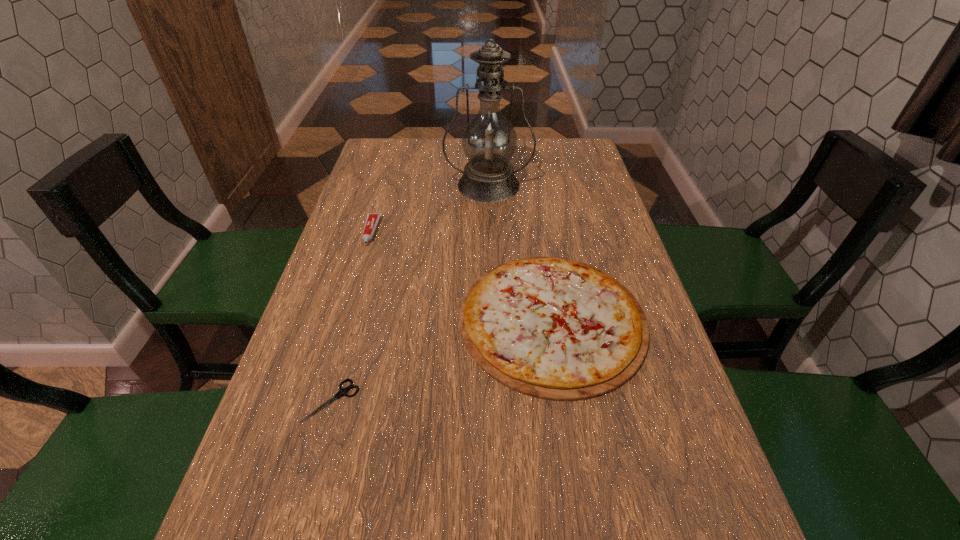
Where is `vacant area between the second farthest object and the shortest object`? The image size is (960, 540). vacant area between the second farthest object and the shortest object is located at coordinates (351, 316).

You are a GUI agent. You are given a task and a screenshot of the screen. Output one action in this format:
    pyautogui.click(x=<x>, y=<y>)
    Task: Click on the free spot between the second shortest object and the second tallest object
    The width and height of the screenshot is (960, 540).
    Given the screenshot: What is the action you would take?
    pyautogui.click(x=462, y=275)

Image resolution: width=960 pixels, height=540 pixels. What are the coordinates of `vacant space that's between the second tallest object and the third tallest object` in the screenshot? It's located at (462, 275).

Identify the location of vacant point located between the tallest object and the third shortest object. Image resolution: width=960 pixels, height=540 pixels. (430, 208).

Where is `free space between the pizza and the third nearest object`? This screenshot has width=960, height=540. free space between the pizza and the third nearest object is located at coordinates (462, 275).

Where is `vacant space that's between the tallest object and the toothpaste`? This screenshot has width=960, height=540. vacant space that's between the tallest object and the toothpaste is located at coordinates (430, 208).

The image size is (960, 540). I want to click on free space between the toothpaste and the shortest object, so click(351, 316).

This screenshot has height=540, width=960. What are the coordinates of `unoccupied area between the tallest object and the shears` in the screenshot? It's located at (410, 293).

The height and width of the screenshot is (540, 960). I want to click on object that is the third closest one to the farthest object, so click(x=342, y=391).

At what (x,y) coordinates should I click in order to perform the action: click on the second closest object to the pizza. Please return your answer as a coordinate pair (x, y). Image resolution: width=960 pixels, height=540 pixels. Looking at the image, I should click on (372, 220).